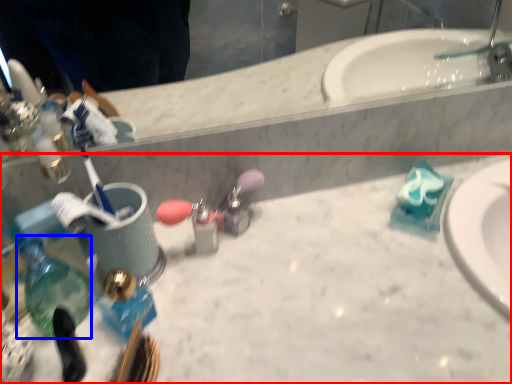
Question: Which object is closer to the camera taking this photo, counter top (highlighted by a red box) or bottle (highlighted by a blue box)?

Choices:
 (A) counter top
 (B) bottle

Answer: (A)